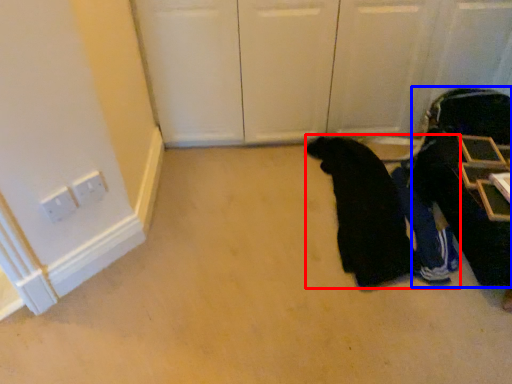
Question: Which of the following is the closest to the observer, person (highlighted by a red box) or luggage (highlighted by a blue box)?

Choices:
 (A) person
 (B) luggage

Answer: (B)